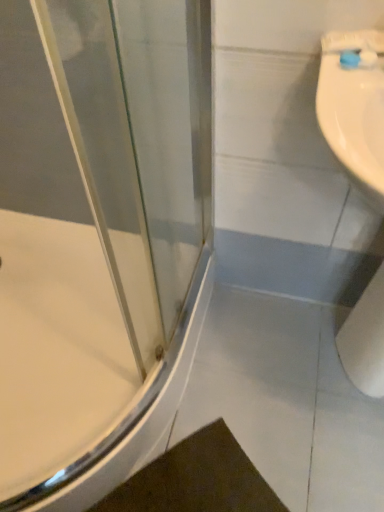
Question: From the image's perspective, is white matte toilet paper at lower right above blue plastic toothbrush at upper right?

Choices:
 (A) yes
 (B) no

Answer: (B)

Question: Is white matte toilet paper at lower right directly adjacent to blue plastic toothbrush at upper right?

Choices:
 (A) yes
 (B) no

Answer: (B)

Question: Can you confirm if white matte toilet paper at lower right is bigger than blue plastic toothbrush at upper right?

Choices:
 (A) no
 (B) yes

Answer: (B)

Question: Is white matte toilet paper at lower right at the right side of blue plastic toothbrush at upper right?

Choices:
 (A) no
 (B) yes

Answer: (B)

Question: From the image's perspective, would you say white matte toilet paper at lower right is shown under blue plastic toothbrush at upper right?

Choices:
 (A) no
 (B) yes

Answer: (B)

Question: From the image's perspective, is white matte toilet paper at lower right above or below white glossy bathtub at left?

Choices:
 (A) below
 (B) above

Answer: (B)

Question: Is white matte toilet paper at lower right taller or shorter than white glossy bathtub at left?

Choices:
 (A) tall
 (B) short

Answer: (A)

Question: Does point (367, 389) appear closer or farther from the camera than point (77, 307)?

Choices:
 (A) closer
 (B) farther

Answer: (A)

Question: Choose the correct answer: Is white matte toilet paper at lower right inside white glossy bathtub at left or outside it?

Choices:
 (A) outside
 (B) inside

Answer: (A)

Question: Is point (36, 309) closer or farther from the camera than point (342, 55)?

Choices:
 (A) closer
 (B) farther

Answer: (B)

Question: Is white glossy bathtub at left bigger or smaller than blue plastic toothbrush at upper right?

Choices:
 (A) small
 (B) big

Answer: (B)

Question: From a real-world perspective, is white glossy bathtub at left positioned above or below blue plastic toothbrush at upper right?

Choices:
 (A) above
 (B) below

Answer: (B)

Question: From their relative heights in the image, would you say white glossy bathtub at left is taller or shorter than blue plastic toothbrush at upper right?

Choices:
 (A) tall
 (B) short

Answer: (A)

Question: In the image, is blue plastic toothbrush at upper right on the left side or the right side of white matte toilet paper at lower right?

Choices:
 (A) right
 (B) left

Answer: (B)

Question: From the image's perspective, is blue plastic toothbrush at upper right positioned above or below white matte toilet paper at lower right?

Choices:
 (A) above
 (B) below

Answer: (A)